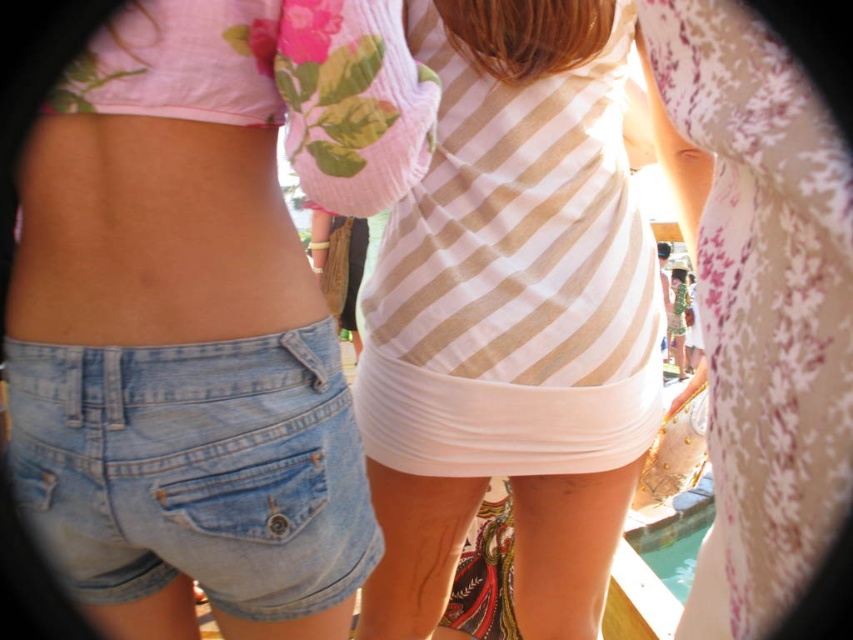
Question: Is white striped tank top at center bigger than light blue denim shorts at lower left?

Choices:
 (A) no
 (B) yes

Answer: (B)

Question: Is white striped tank top at center in front of white matte underwear at center?

Choices:
 (A) no
 (B) yes

Answer: (B)

Question: Which object is closer to the camera taking this photo?

Choices:
 (A) white striped tank top at center
 (B) white matte underwear at center
 (C) denim shorts at left
 (D) light blue denim shorts at lower left

Answer: (C)

Question: Can you confirm if white striped tank top at center is thinner than light blue denim shorts at lower left?

Choices:
 (A) yes
 (B) no

Answer: (B)

Question: Which object appears farthest from the camera in this image?

Choices:
 (A) light blue denim shorts at lower left
 (B) white striped tank top at center

Answer: (B)

Question: Considering the real-world distances, which object is closest to the denim shorts at left?

Choices:
 (A) light blue denim shorts at lower left
 (B) white striped tank top at center
 (C) white matte underwear at center

Answer: (A)